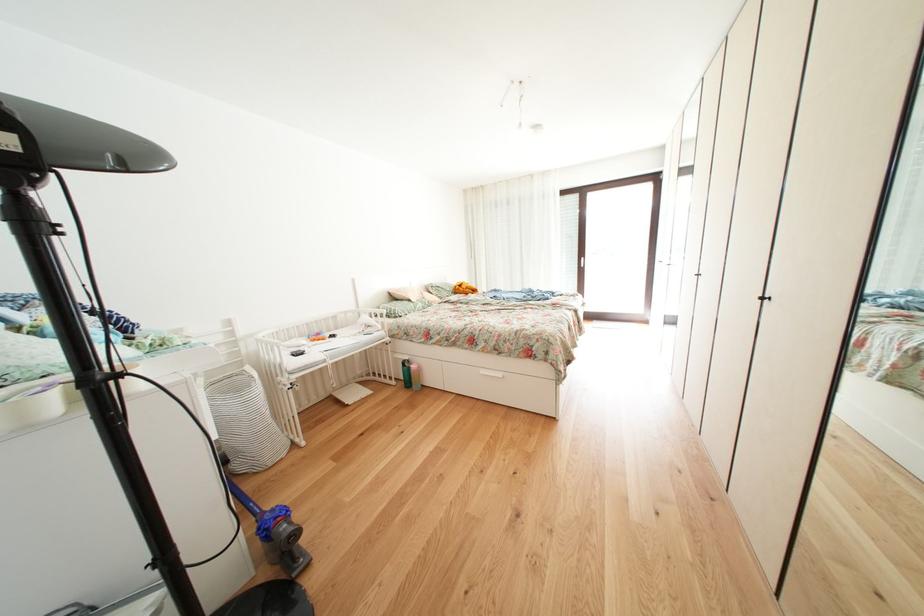
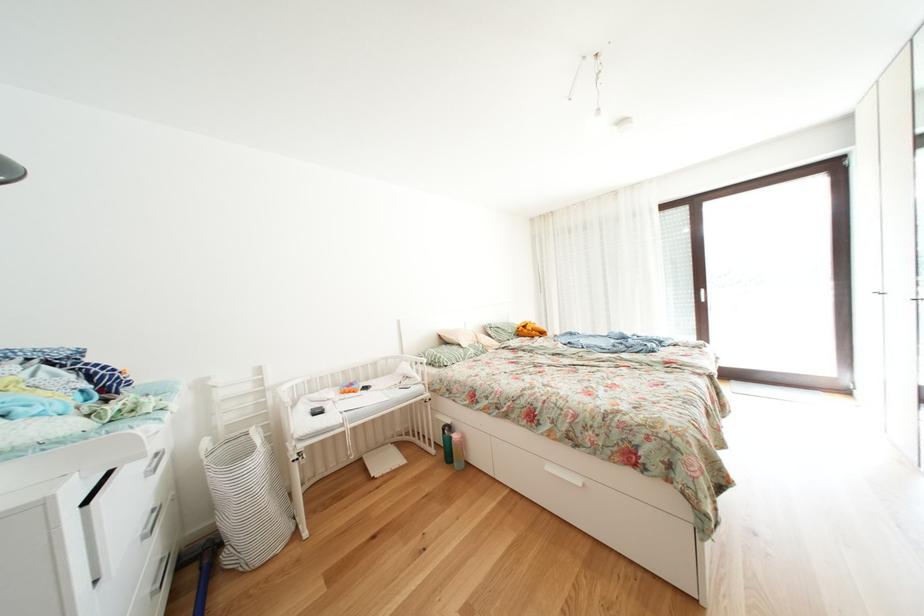
Locate, in the second image, the point that corresponds to [418,367] in the first image.

(458, 432)